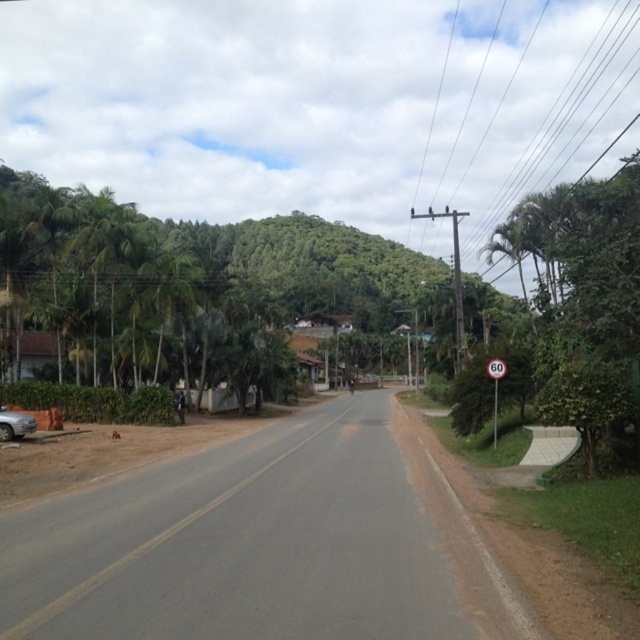
Question: In this image, where is silver metallic car at lower left located relative to white plastic speed limit sign at right?

Choices:
 (A) left
 (B) right

Answer: (A)

Question: Which of the following is the closest to the observer?

Choices:
 (A) (269, 372)
 (B) (26, 432)
 (C) (499, 380)

Answer: (C)

Question: Observing the image, what is the correct spatial positioning of silver metallic car at lower left in reference to white plastic speed limit sign at right?

Choices:
 (A) below
 (B) above

Answer: (A)

Question: Which of the following is the farthest from the observer?

Choices:
 (A) (170, 260)
 (B) (493, 388)

Answer: (A)

Question: Which is nearer to the green leafy trees at left?

Choices:
 (A) white plastic speed limit sign at right
 (B) silver metallic car at lower left

Answer: (B)

Question: In this image, where is green leafy trees at left located relative to white plastic speed limit sign at right?

Choices:
 (A) left
 (B) right

Answer: (A)